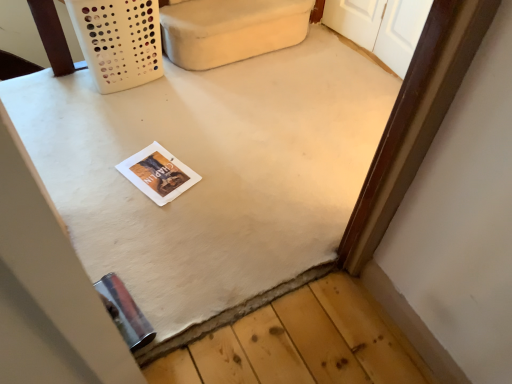
Locate an element on the screen. This screenshot has height=384, width=512. vacant space in front of white fabric couch at upper center is located at coordinates (226, 117).